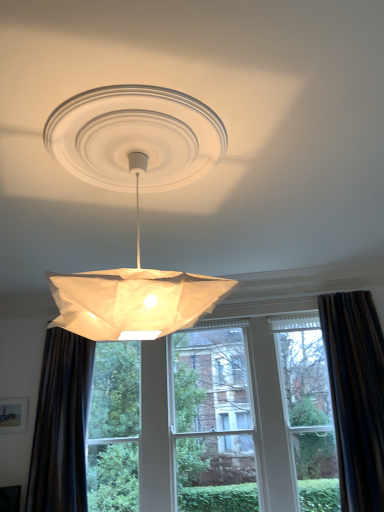
Describe the element at coordinates (136, 204) in the screenshot. I see `white paper lampshade at center` at that location.

You are a GUI agent. You are given a task and a screenshot of the screen. Output one action in this format:
    pyautogui.click(x=<x>, y=<y>)
    Task: Click on the dark fabric curtain at right, marked as the 1th curtain in a right-to-left arrangement
    
    Given the screenshot: What is the action you would take?
    pyautogui.click(x=356, y=395)

Where is `white paper lampshade at center`? The width and height of the screenshot is (384, 512). white paper lampshade at center is located at coordinates (136, 204).

Would you say white paper lampshade at center is a long distance from dark fabric curtain at right, marked as the 1th curtain in a right-to-left arrangement?

white paper lampshade at center is far away from dark fabric curtain at right, marked as the 1th curtain in a right-to-left arrangement.

Between white paper lampshade at center and dark fabric curtain at right, marked as the 1th curtain in a right-to-left arrangement, which one has less height?

Standing shorter between the two is white paper lampshade at center.

Is white paper lampshade at center further to the viewer compared to dark fabric curtain at right, which appears as the second curtain when viewed from the left?

That is False.

Would you consider white paper lampshade at center to be distant from transparent glass window at center?

Yes.

Which is in front, white paper lampshade at center or transparent glass window at center?

white paper lampshade at center is more forward.

From the image's perspective, does white paper lampshade at center appear higher than transparent glass window at center?

Yes.

From the picture: From the image's perspective, which is below, transparent glass window at center or white paper lampshade at center?

transparent glass window at center appears lower in the image.

Locate an element on the screen. window that is under the white paper lampshade at center (from a real-world perspective) is located at coordinates (356, 395).

Is transparent glass window at center to the right of white paper lampshade at center from the viewer's perspective?

Yes, transparent glass window at center is to the right of white paper lampshade at center.

From the image's perspective, does dark fabric curtain at right, which appears as the second curtain when viewed from the left, appear higher than white paper lampshade at center?

No, from the image's perspective, dark fabric curtain at right, which appears as the second curtain when viewed from the left, is not above white paper lampshade at center.

How far apart are dark fabric curtain at right, marked as the 1th curtain in a right-to-left arrangement, and white paper lampshade at center?

A distance of 7.77 feet exists between dark fabric curtain at right, marked as the 1th curtain in a right-to-left arrangement, and white paper lampshade at center.

Is the position of dark fabric curtain at right, marked as the 1th curtain in a right-to-left arrangement, more distant than that of white paper lampshade at center?

Yes, it is behind white paper lampshade at center.

Who is taller, dark fabric curtain at right, marked as the 1th curtain in a right-to-left arrangement, or white paper lampshade at center?

With more height is dark fabric curtain at right, marked as the 1th curtain in a right-to-left arrangement.

Considering the sizes of dark brown textured curtain at left, the 1th curtain positioned from the left, and dark fabric curtain at right, marked as the 1th curtain in a right-to-left arrangement, in the image, is dark brown textured curtain at left, the 1th curtain positioned from the left, bigger or smaller than dark fabric curtain at right, marked as the 1th curtain in a right-to-left arrangement,?

In the image, dark brown textured curtain at left, the 1th curtain positioned from the left, appears to be smaller than dark fabric curtain at right, marked as the 1th curtain in a right-to-left arrangement.

From the image's perspective, between dark brown textured curtain at left, the second curtain from the right, and dark fabric curtain at right, marked as the 1th curtain in a right-to-left arrangement, who is located below?

dark brown textured curtain at left, the second curtain from the right, from the image's perspective.

Which point is more forward, (x=67, y=341) or (x=373, y=392)?

The point (x=373, y=392) is in front.

Is dark brown textured curtain at left, the second curtain from the right, inside the boundaries of dark fabric curtain at right, marked as the 1th curtain in a right-to-left arrangement, or outside?

dark brown textured curtain at left, the second curtain from the right, is outside dark fabric curtain at right, marked as the 1th curtain in a right-to-left arrangement.

Which point is more distant from viewer, (136, 314) or (37, 415)?

The point (37, 415) is farther.

Does white paper lampshade at center have a greater width compared to dark brown textured curtain at left, the second curtain from the right?

Yes.

Does dark fabric curtain at right, marked as the 1th curtain in a right-to-left arrangement, have a lesser width compared to dark brown textured curtain at left, the second curtain from the right?

Yes, dark fabric curtain at right, marked as the 1th curtain in a right-to-left arrangement, is thinner than dark brown textured curtain at left, the second curtain from the right.

Between dark fabric curtain at right, which appears as the second curtain when viewed from the left, and dark brown textured curtain at left, the second curtain from the right, which one appears on the right side from the viewer's perspective?

From the viewer's perspective, dark fabric curtain at right, which appears as the second curtain when viewed from the left, appears more on the right side.

Would you say dark fabric curtain at right, which appears as the second curtain when viewed from the left, is inside or outside dark brown textured curtain at left, the second curtain from the right?

dark fabric curtain at right, which appears as the second curtain when viewed from the left, lies outside dark brown textured curtain at left, the second curtain from the right.

Is dark fabric curtain at right, marked as the 1th curtain in a right-to-left arrangement, oriented towards dark brown textured curtain at left, the 1th curtain positioned from the left?

No.

There is a white paper lampshade at center. Identify the location of the 2nd curtain below it (from a real-world perspective). The image size is (384, 512). (356, 395).

At what (x,y) coordinates should I click in order to perform the action: click on lamp above the transparent glass window at center (from the image's perspective). Please return your answer as a coordinate pair (x, y). The image size is (384, 512). Looking at the image, I should click on (136, 204).

Estimate the real-world distances between objects in this image. Which object is further from transparent glass window at center, white paper lampshade at center or dark fabric curtain at right, which appears as the second curtain when viewed from the left?

white paper lampshade at center.

When comparing their distances from white paper lampshade at center, does dark brown textured curtain at left, the 1th curtain positioned from the left, or dark fabric curtain at right, marked as the 1th curtain in a right-to-left arrangement, seem further?

dark fabric curtain at right, marked as the 1th curtain in a right-to-left arrangement, is further to white paper lampshade at center.

Considering their positions, is transparent glass window at center positioned further to dark fabric curtain at right, which appears as the second curtain when viewed from the left, than white paper lampshade at center?

white paper lampshade at center is positioned further to the anchor dark fabric curtain at right, which appears as the second curtain when viewed from the left.

Which object lies further to the anchor point transparent glass window at center, dark fabric curtain at right, marked as the 1th curtain in a right-to-left arrangement, or white paper lampshade at center?

The object further to transparent glass window at center is white paper lampshade at center.

When comparing their distances from dark fabric curtain at right, marked as the 1th curtain in a right-to-left arrangement, does white paper lampshade at center or transparent glass window at center seem further?

white paper lampshade at center is positioned further to the anchor dark fabric curtain at right, marked as the 1th curtain in a right-to-left arrangement.

Considering their positions, is dark fabric curtain at right, marked as the 1th curtain in a right-to-left arrangement, positioned further to dark brown textured curtain at left, the 1th curtain positioned from the left, than white paper lampshade at center?

Among the two, white paper lampshade at center is located further to dark brown textured curtain at left, the 1th curtain positioned from the left.

When comparing their distances from dark brown textured curtain at left, the second curtain from the right, does transparent glass window at center or white paper lampshade at center seem further?

Among the two, white paper lampshade at center is located further to dark brown textured curtain at left, the second curtain from the right.

From the image, which object appears to be nearer to white paper lampshade at center, transparent glass window at center or dark fabric curtain at right, which appears as the second curtain when viewed from the left?

transparent glass window at center is closer to white paper lampshade at center.

The width and height of the screenshot is (384, 512). Identify the location of window between dark brown textured curtain at left, the 1th curtain positioned from the left, and dark fabric curtain at right, marked as the 1th curtain in a right-to-left arrangement, in the horizontal direction. (356, 395).

Identify the location of lamp situated between dark brown textured curtain at left, the second curtain from the right, and dark fabric curtain at right, marked as the 1th curtain in a right-to-left arrangement, from left to right. (136, 204).